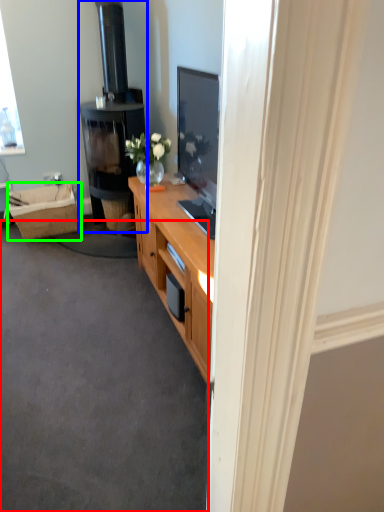
Question: Which is nearer to the plain (highlighted by a red box)? fireplace (highlighted by a blue box) or picnic basket (highlighted by a green box).

Choices:
 (A) fireplace
 (B) picnic basket

Answer: (B)